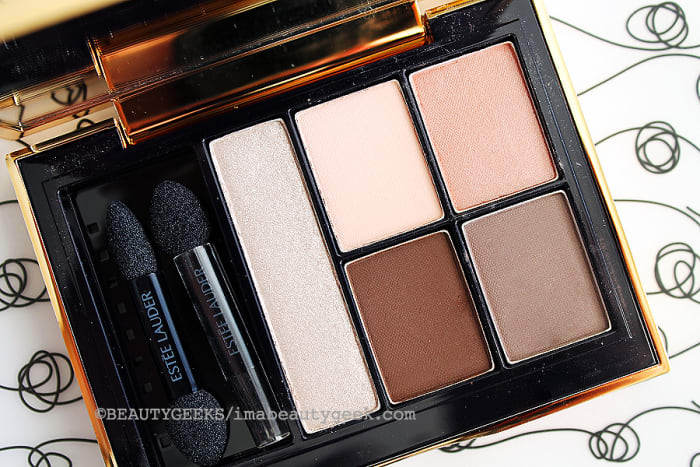
The height and width of the screenshot is (467, 700). What are the coordinates of `makeup  bruches` in the screenshot? It's located at (171, 338), (253, 380).